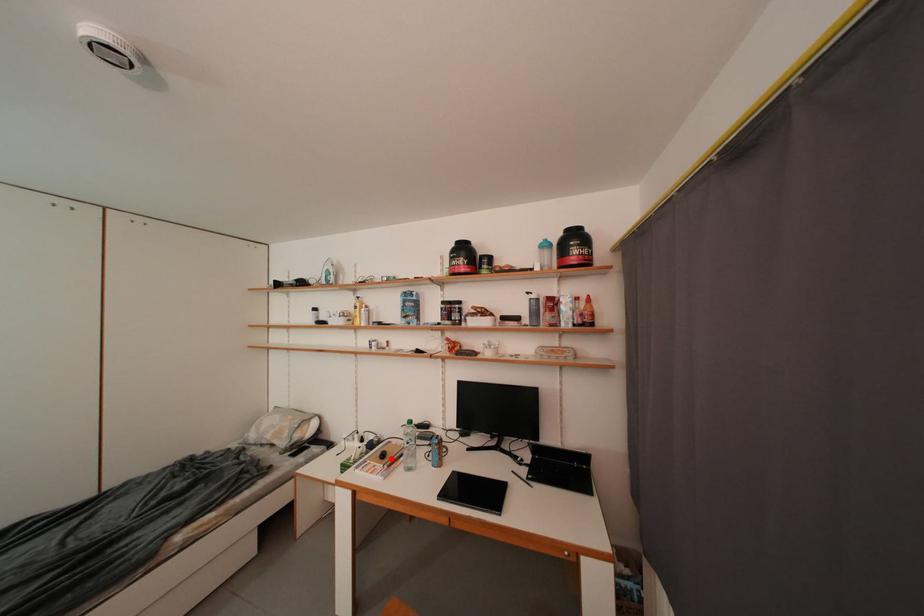
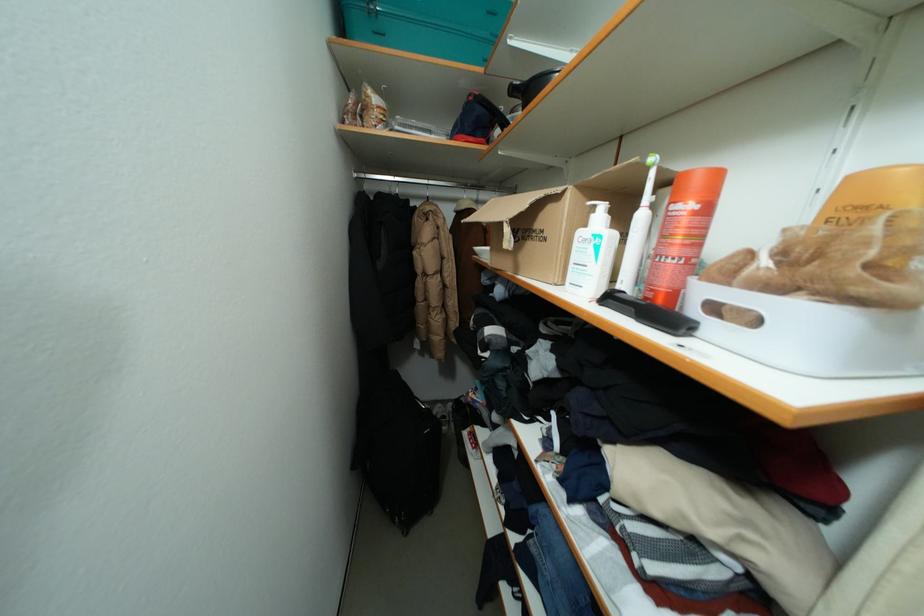
Question: I am providing you with two images of the same scene from different viewpoints. A red point is marked on the first image. At the location where the point appears in image 1, is it still visible in image 2?

Choices:
 (A) Yes
 (B) No

Answer: (B)